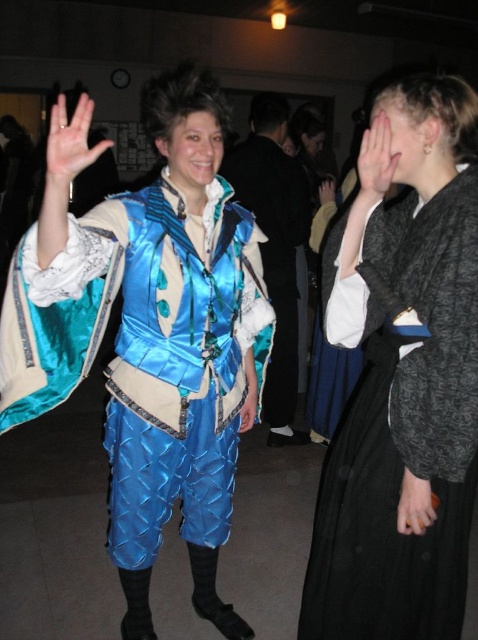
You are a photographer at the event and want to capture a photo where both the shiny blue armor at center and the smooth skin hand at center are clearly visible. Based on their sizes, which object should you focus on to ensure both are in frame?

The shiny blue armor at center is taller than the smooth skin hand at center, so focusing on the shiny blue armor at center will ensure both are in frame as it is larger and central.

You are at a costume party and see two hands in front of you. One is the smooth brown leather hand at center right and the other is the blue satin hand at center. Which hand is positioned further to the right?

The smooth brown leather hand at center right is positioned further to the right than the blue satin hand at center.

You are a photographer at the event and want to capture both hands in a photo. Given that the smooth brown leather hand at center right is shorter than the blue satin hand at center, which hand should you position closer to the camera to ensure both appear equally tall in the photo?

To make both hands appear equally tall in the photo, position the smooth brown leather hand at center right closer to the camera since it has a lesser height compared to the blue satin hand at center.